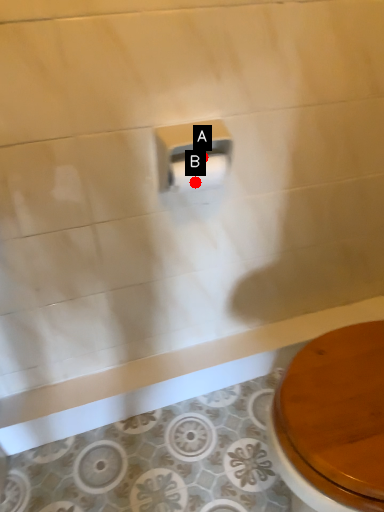
Question: Two points are circled on the image, labeled by A and B beside each circle. Which point appears closest to the camera in this image?

Choices:
 (A) A is closer
 (B) B is closer

Answer: (B)